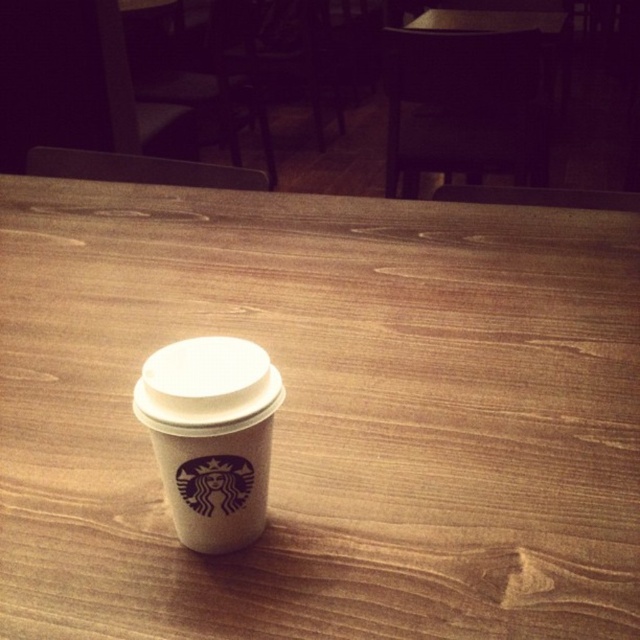
Question: Which of the following is the farthest from the observer?

Choices:
 (A) wooden table at center
 (B) white paper cup at center

Answer: (A)

Question: Which point appears farthest from the camera in this image?

Choices:
 (A) (228, 458)
 (B) (528, 412)

Answer: (B)

Question: Can you confirm if wooden table at center is thinner than white paper cup at center?

Choices:
 (A) yes
 (B) no

Answer: (B)

Question: Is wooden table at center to the left of white paper cup at center from the viewer's perspective?

Choices:
 (A) no
 (B) yes

Answer: (B)

Question: Does wooden table at center have a lesser width compared to white paper cup at center?

Choices:
 (A) yes
 (B) no

Answer: (B)